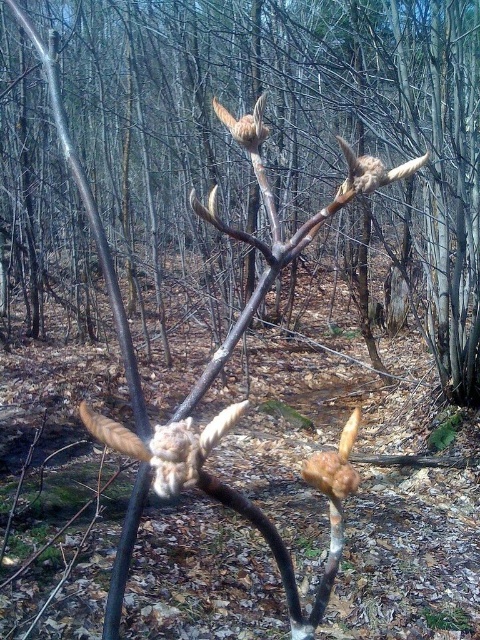
Question: Is fuzzy brown branch at center positioned at the back of brown fuzzy bird at upper center?

Choices:
 (A) yes
 (B) no

Answer: (B)

Question: Can you confirm if fuzzy brown branch at center is positioned to the left of brown fuzzy branch at upper center?

Choices:
 (A) no
 (B) yes

Answer: (B)

Question: Among these objects, which one is nearest to the camera?

Choices:
 (A) brown fuzzy bird at upper center
 (B) brown rough bark at center
 (C) fuzzy brown branch at center
 (D) brown fuzzy branch at upper center

Answer: (C)

Question: Which point is closer to the camera taking this photo?

Choices:
 (A) (337, 189)
 (B) (182, 488)
 (C) (256, 112)
 (D) (311, 147)

Answer: (B)

Question: Can you confirm if brown rough bark at center is wider than brown fuzzy branch at upper center?

Choices:
 (A) yes
 (B) no

Answer: (A)

Question: Which point is closer to the camera taking this photo?

Choices:
 (A) (374, 180)
 (B) (437, 288)
 (C) (250, 145)

Answer: (A)